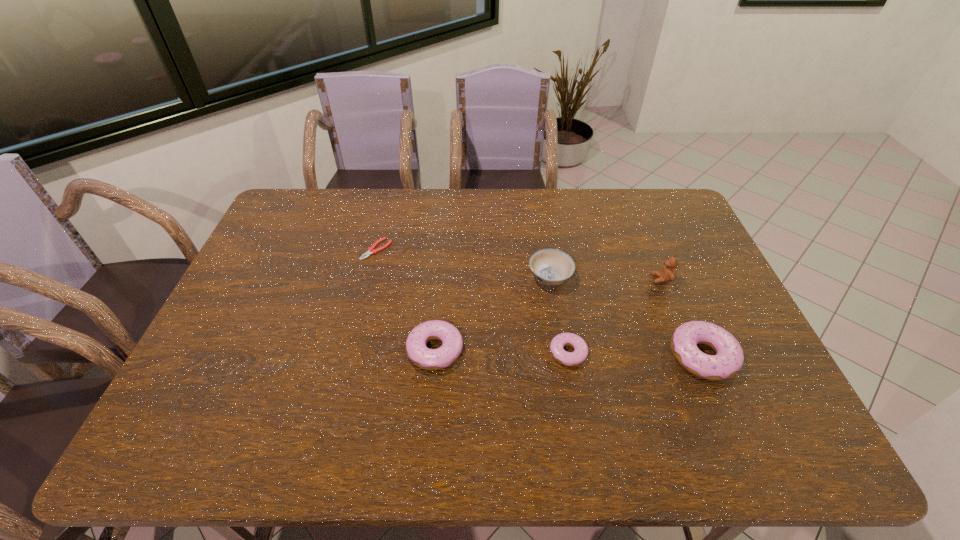
Where is `free space between the farthest object and the rightmost doughnut`? The image size is (960, 540). free space between the farthest object and the rightmost doughnut is located at coordinates (540, 302).

You are a GUI agent. You are given a task and a screenshot of the screen. Output one action in this format:
    pyautogui.click(x=<x>, y=<y>)
    Task: Click on the unoccupied position between the rightmost doughnut and the fifth tallest object
    The width and height of the screenshot is (960, 540).
    Given the screenshot: What is the action you would take?
    pyautogui.click(x=636, y=354)

Identify the location of free space between the leftmost object and the rightmost doughnut. This screenshot has width=960, height=540. (540, 302).

The width and height of the screenshot is (960, 540). In order to click on free space between the bowl and the rightmost doughnut in this screenshot , I will do `click(627, 316)`.

The width and height of the screenshot is (960, 540). What are the coordinates of `empty location between the teddy bear and the rightmost doughnut` in the screenshot? It's located at (683, 318).

Locate an element on the screen. This screenshot has height=540, width=960. free space between the teddy bear and the third shortest object is located at coordinates (548, 314).

The width and height of the screenshot is (960, 540). I want to click on the fifth closest object relative to the fifth tallest object, so click(371, 250).

Choose which object is the third nearest neighbor to the tallest object. Please provide its 2D coordinates. Your answer should be formatted as a tuple, i.e. [(x, y)], where the tuple contains the x and y coordinates of a point satisfying the conditions above.

[(557, 345)]

Identify which doughnut is located as the nearest to the leftmost object. Please provide its 2D coordinates. Your answer should be formatted as a tuple, i.e. [(x, y)], where the tuple contains the x and y coordinates of a point satisfying the conditions above.

[(429, 359)]

The width and height of the screenshot is (960, 540). Find the location of `doughnut that is the third closest to the tallest object`. doughnut that is the third closest to the tallest object is located at coordinates (429, 359).